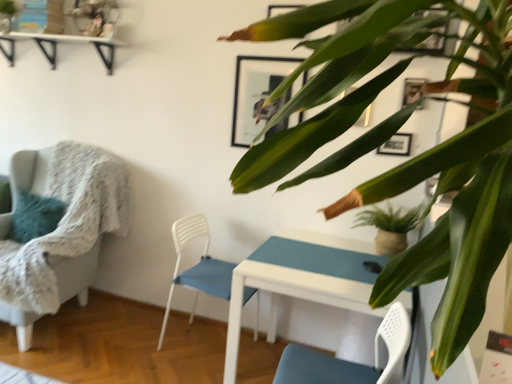
Where is `vacant space underneath white plastic chair at center, marked as the second chair in a left-to-right arrangement (from a real-world perspective)`? This screenshot has width=512, height=384. vacant space underneath white plastic chair at center, marked as the second chair in a left-to-right arrangement (from a real-world perspective) is located at coordinates (202, 348).